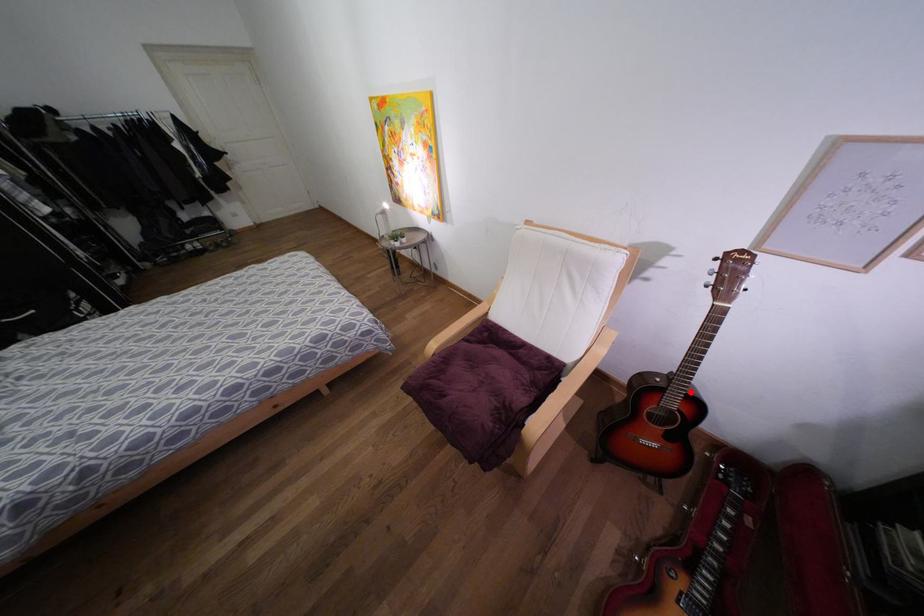
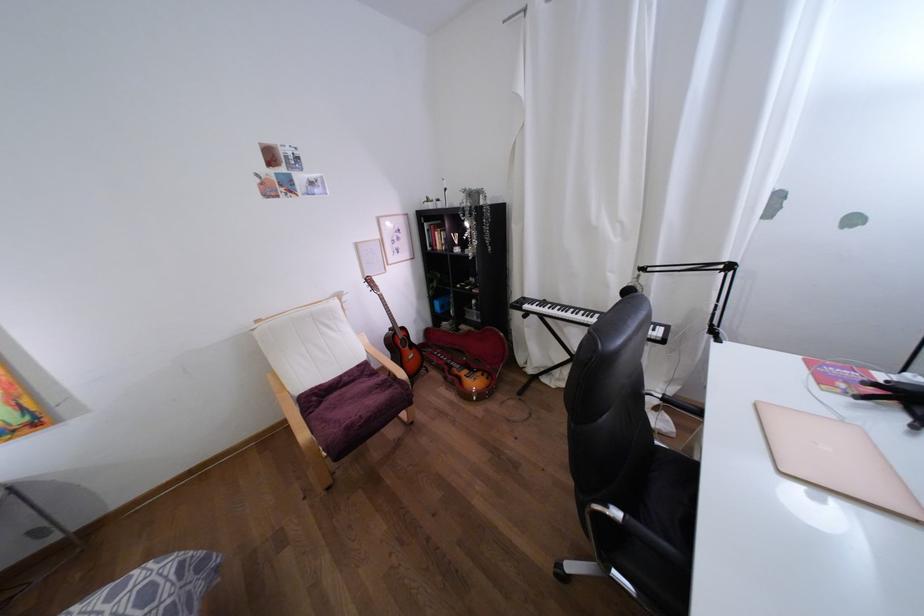
Where in the second image is the point corresponding to the highlighted location from the first image?

(398, 325)